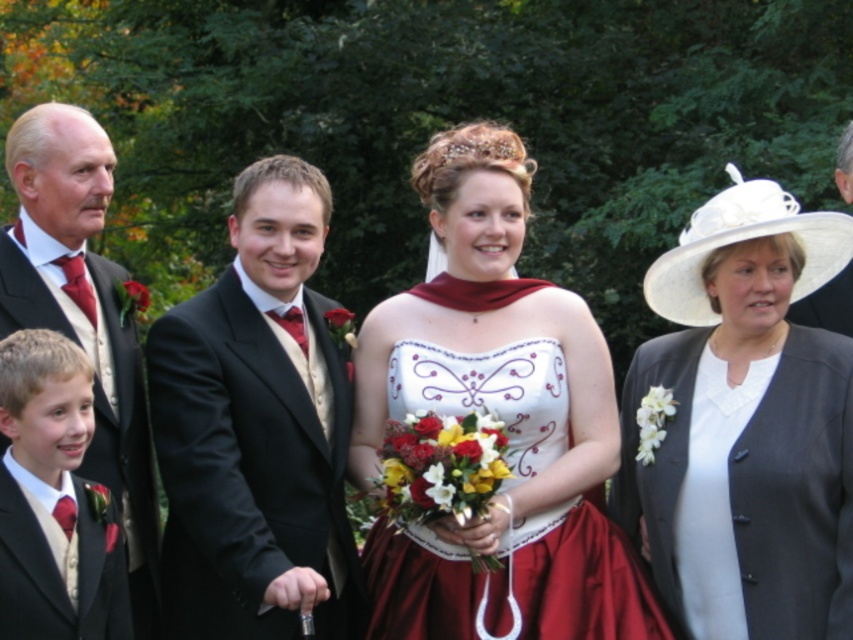
You are organizing a photo shoot and need to place a 1.2 meter wide backdrop behind the white felt hat at upper right and the matte black suit at left. Which object requires a wider backdrop to fit its width?

The white felt hat at upper right requires a wider backdrop because its width surpasses that of the matte black suit at left.

You are standing at the point labeled point (x=94, y=340) and want to throw a paper airplane to reach the other side of the room without hitting anyone. Considering the distance between you and the central figure, can you estimate if the paper airplane will travel far enough?

The distance between you and the central figure is 6.63 meters. Since paper airplanes typically have a flight range of about 10 to 20 meters, your paper airplane should easily reach the other side without hitting anyone.